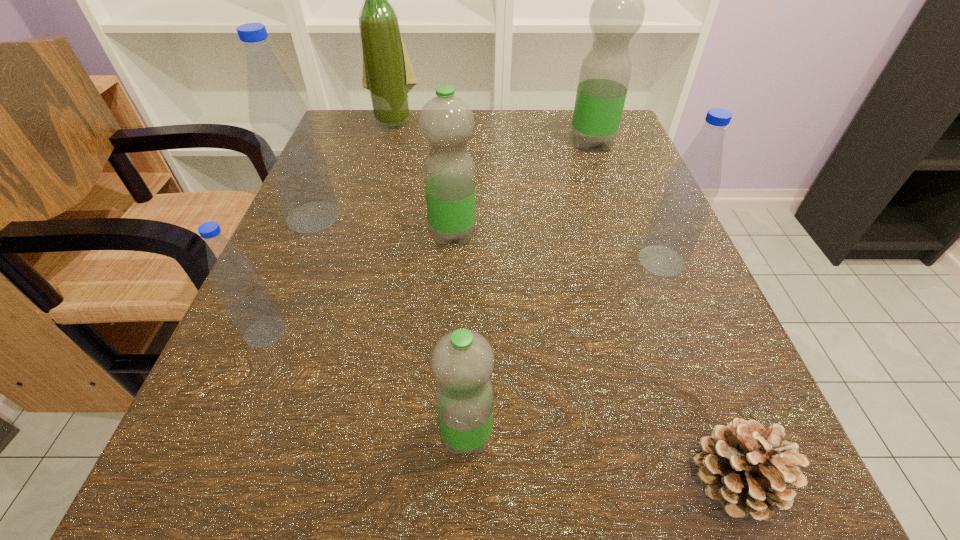
This screenshot has height=540, width=960. Find the location of `the nearest water bottle`. the nearest water bottle is located at coordinates (462, 361).

Find the location of a particular element. The height and width of the screenshot is (540, 960). the shortest object is located at coordinates (745, 466).

The height and width of the screenshot is (540, 960). What are the coordinates of `pinecone` in the screenshot? It's located at (745, 466).

Identify the location of vacant space situated on the front-facing side of the wine bottle. Image resolution: width=960 pixels, height=540 pixels. (376, 182).

Where is `free space located on the left of the rightmost green water bottle`? The height and width of the screenshot is (540, 960). free space located on the left of the rightmost green water bottle is located at coordinates (498, 143).

Find the location of a particular element. vacant space located 0.150m on the back of the biggest blue water bottle is located at coordinates (339, 158).

I want to click on vacant space located on the back of the second farthest green water bottle, so click(x=459, y=149).

This screenshot has height=540, width=960. Identify the location of blank area located on the left of the rightmost blue water bottle. (483, 261).

Where is `free location located on the back of the second nearest water bottle`? The image size is (960, 540). free location located on the back of the second nearest water bottle is located at coordinates (330, 177).

This screenshot has height=540, width=960. In order to click on vacant space located on the right of the nearest green water bottle in this screenshot , I will do `click(718, 435)`.